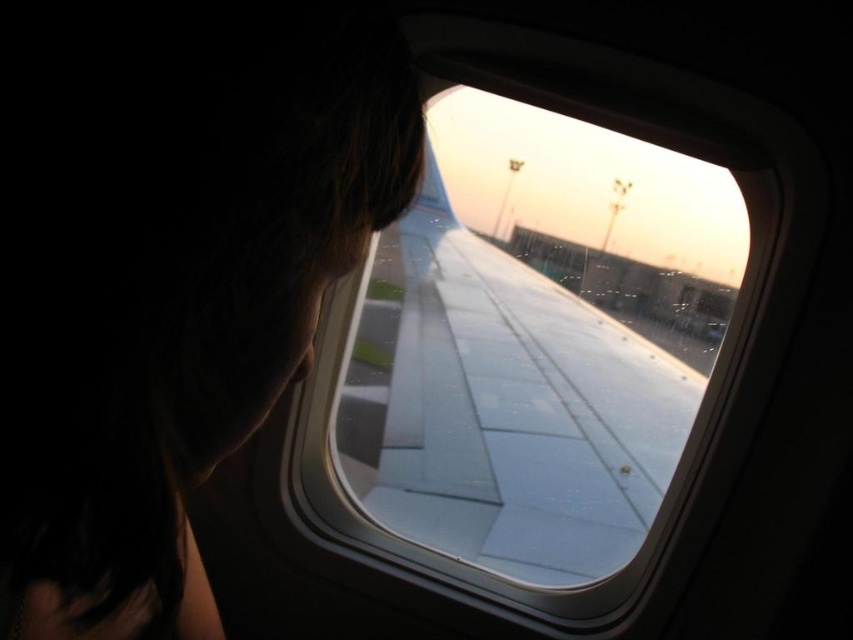
Consider the image. You are a flight attendant carrying a 1.5 meter long tray. You need to move from the dark hair at left to the transparent glass wing at center. Can you move the tray horizontally between them without tilting it?

The distance between dark hair at left and transparent glass wing at center is 1.26 meters. Since the tray is 1.5 meters long, it is longer than the space available. Therefore, you cannot move the tray horizontally between them without tilting it.

You are a passenger sitting in the airplane seat and looking out the window. You notice dark hair at left and transparent glass wing at center in your view. Which object appears narrower in your field of view?

The dark hair at left appears narrower compared to the transparent glass wing at center because it has a lesser width.

You are a passenger sitting in the airplane seat and looking out the window. You notice a dark hair at left. Where exactly is the dark hair located in relation to the window frame?

The dark hair at left is located at point (169, 273) on the window frame.